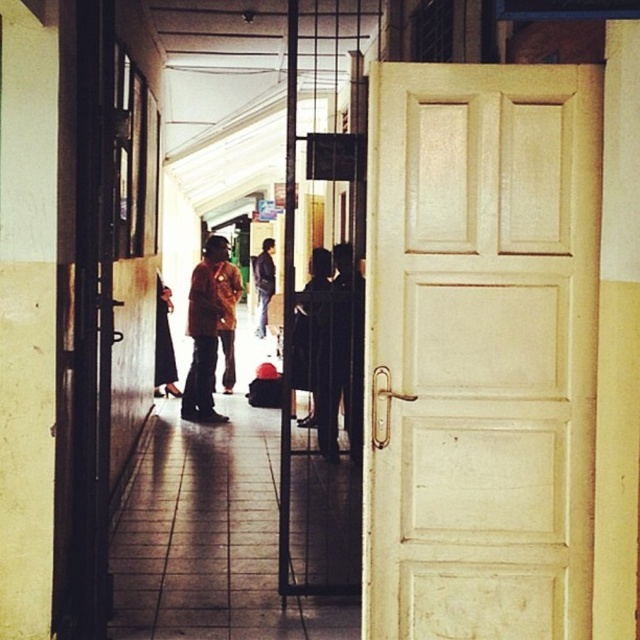
Question: Which point is farther from the camera taking this photo?

Choices:
 (A) (195, 321)
 (B) (156, 392)
 (C) (227, 307)
 (D) (266, 296)

Answer: (D)

Question: Is white matte door at right thinner than brown leather jacket at center?

Choices:
 (A) yes
 (B) no

Answer: (B)

Question: Can you confirm if black fabric dress at left is bigger than dark blue jeans at center?

Choices:
 (A) no
 (B) yes

Answer: (A)

Question: Based on their relative distances, which object is farther from the white matte door at right?

Choices:
 (A) brown fabric shirt at center
 (B) brown leather jacket at center
 (C) black fabric dress at left
 (D) dark blue jeans at center

Answer: (D)

Question: Among these points, which one is nearest to the camera?

Choices:
 (A) (232, 339)
 (B) (161, 394)
 (C) (470, 124)

Answer: (C)

Question: Is brown fabric shirt at center thinner than dark blue jeans at center?

Choices:
 (A) no
 (B) yes

Answer: (B)